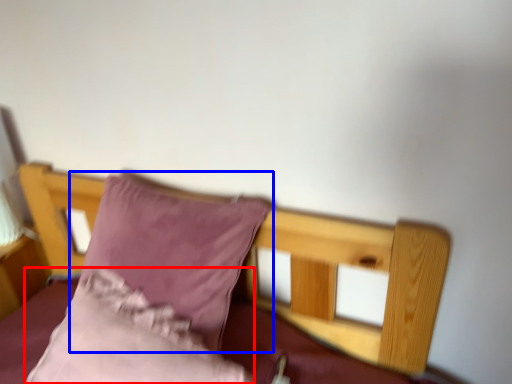
Question: Which object is closer to the camera taking this photo, pillow (highlighted by a red box) or pillow (highlighted by a blue box)?

Choices:
 (A) pillow
 (B) pillow

Answer: (A)